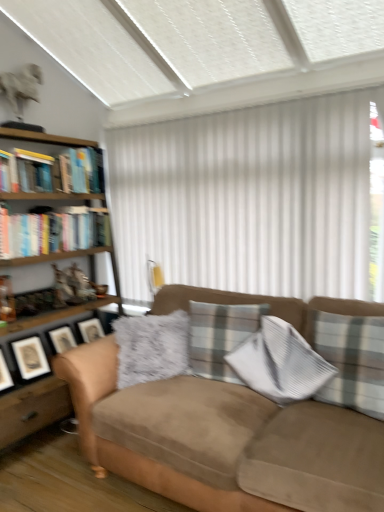
This screenshot has width=384, height=512. I want to click on hardcover books at left, which ranks as the fourth book in top-to-bottom order, so (53, 231).

Where is `suede couch at center`? The image size is (384, 512). suede couch at center is located at coordinates pyautogui.click(x=226, y=443).

Identify the location of hardcover book at left, the 3th book positioned from the bottom. (28, 170).

Measure the distance between point [13,193] and camera.

Point [13,193] and camera are 8.58 feet apart from each other.

This screenshot has width=384, height=512. What do you see at coordinates (351, 360) in the screenshot? I see `plaid fabric pillow at right, which is the second pillow from left to right` at bounding box center [351, 360].

Where is `hardcover book at left, arranged as the third book when viewed from the top`? hardcover book at left, arranged as the third book when viewed from the top is located at coordinates (8, 172).

Based on the photo, would you say plaid fabric pillow at center, which appears as the 1th pillow when viewed from the left, is inside or outside plaid fabric pillow at right, which is the second pillow from left to right?

plaid fabric pillow at center, which appears as the 1th pillow when viewed from the left, is spatially situated outside plaid fabric pillow at right, which is the second pillow from left to right.

Does plaid fabric pillow at center, marked as the 2th pillow in a right-to-left arrangement, have a smaller size compared to plaid fabric pillow at right, which is the second pillow from left to right?

Indeed, plaid fabric pillow at center, marked as the 2th pillow in a right-to-left arrangement, has a smaller size compared to plaid fabric pillow at right, which is the second pillow from left to right.

Which object is wider, plaid fabric pillow at center, which appears as the 1th pillow when viewed from the left, or plaid fabric pillow at right, which is the second pillow from left to right?

plaid fabric pillow at right, which is the second pillow from left to right, is wider.

In the image, there is a hardcover book at upper left, the fourth book in the bottom-to-top sequence. At what (x,y) coordinates should I click in order to perform the action: click on curtain below it (from the image's perspective). Please return your answer as a coordinate pair (x, y). This screenshot has height=512, width=384. Looking at the image, I should click on (247, 199).

Considering the relative sizes of hardcover book at upper left, which is the first book in top-to-bottom order, and white vertical blinds at center in the image provided, is hardcover book at upper left, which is the first book in top-to-bottom order, bigger than white vertical blinds at center?

Incorrect, hardcover book at upper left, which is the first book in top-to-bottom order, is not larger than white vertical blinds at center.

Who is shorter, hardcover book at upper left, the fourth book in the bottom-to-top sequence, or white vertical blinds at center?

With less height is hardcover book at upper left, the fourth book in the bottom-to-top sequence.

Is point (93, 152) positioned behind point (366, 260)?

Yes, it is behind point (366, 260).

Considering the positions of objects hardcover book at left, the 3th book positioned from the bottom, and suede couch at center in the image provided, who is more to the right, hardcover book at left, the 3th book positioned from the bottom, or suede couch at center?

Positioned to the right is suede couch at center.

Is hardcover book at left, the 3th book positioned from the bottom, directly adjacent to suede couch at center?

There is a gap between hardcover book at left, the 3th book positioned from the bottom, and suede couch at center.

In terms of size, does hardcover book at left, the 3th book positioned from the bottom, appear bigger or smaller than suede couch at center?

Considering their sizes, hardcover book at left, the 3th book positioned from the bottom, takes up less space than suede couch at center.

Looking at this image, from a real-world perspective, who is located higher, hardcover book at left, which appears as the 2th book when viewed from the top, or suede couch at center?

From a 3D spatial view, hardcover book at left, which appears as the 2th book when viewed from the top, is above.

Measure the distance from plaid fabric pillow at right, which is the second pillow from left to right, to matte black picture frame at left.

They are 5.94 feet apart.

Is plaid fabric pillow at right, which is the second pillow from left to right, closer to camera compared to matte black picture frame at left?

Yes, the depth of plaid fabric pillow at right, which is the second pillow from left to right, is less than that of matte black picture frame at left.

Can you tell me how much plaid fabric pillow at right, which appears as the first pillow when viewed from the right, and matte black picture frame at left differ in facing direction?

There is a 101-degree angle between the facing directions of plaid fabric pillow at right, which appears as the first pillow when viewed from the right, and matte black picture frame at left.

Looking at this image, is plaid fabric pillow at right, which is the second pillow from left to right, thinner than matte black picture frame at left?

Incorrect, the width of plaid fabric pillow at right, which is the second pillow from left to right, is not less than that of matte black picture frame at left.

From the image's perspective, between matte black picture frame at left and plaid fabric pillow at center, marked as the 2th pillow in a right-to-left arrangement, which one is located above?

From the image's view, plaid fabric pillow at center, marked as the 2th pillow in a right-to-left arrangement, is above.

Considering the relative sizes of matte black picture frame at left and plaid fabric pillow at center, which appears as the 1th pillow when viewed from the left, in the image provided, is matte black picture frame at left wider than plaid fabric pillow at center, which appears as the 1th pillow when viewed from the left,?

No.

Is matte black picture frame at left positioned before plaid fabric pillow at center, marked as the 2th pillow in a right-to-left arrangement?

No, matte black picture frame at left is further to the viewer.

Locate an element on the screen. The image size is (384, 512). the 1st pillow counting from the right side of the matte black picture frame at left is located at coordinates (220, 336).

From the image's perspective, is matte black picture frame at left located above or below plaid fabric pillow at right, which is the second pillow from left to right?

Clearly, from the image's perspective, matte black picture frame at left is below plaid fabric pillow at right, which is the second pillow from left to right.

Is plaid fabric pillow at right, which appears as the first pillow when viewed from the right, at the back of matte black picture frame at left?

No, matte black picture frame at left is not facing the opposite direction of plaid fabric pillow at right, which appears as the first pillow when viewed from the right.

Looking at this image, would you say matte black picture frame at left is a long distance from plaid fabric pillow at right, which appears as the first pillow when viewed from the right?

matte black picture frame at left is positioned a significant distance from plaid fabric pillow at right, which appears as the first pillow when viewed from the right.

Which is in front, point (36, 355) or point (354, 384)?

The point (354, 384) is more forward.

Looking at this image, does plaid fabric pillow at center, which appears as the 1th pillow when viewed from the left, contain woodenmaterial/texturebookcase at left?

No, woodenmaterial/texturebookcase at left is located outside of plaid fabric pillow at center, which appears as the 1th pillow when viewed from the left.

Would you say plaid fabric pillow at center, marked as the 2th pillow in a right-to-left arrangement, is to the left or to the right of woodenmaterial/texturebookcase at left in the picture?

plaid fabric pillow at center, marked as the 2th pillow in a right-to-left arrangement, is to the right of woodenmaterial/texturebookcase at left.

Is plaid fabric pillow at center, which appears as the 1th pillow when viewed from the left, wider or thinner than woodenmaterial/texturebookcase at left?

plaid fabric pillow at center, which appears as the 1th pillow when viewed from the left, is thinner than woodenmaterial/texturebookcase at left.

Who is bigger, plaid fabric pillow at center, which appears as the 1th pillow when viewed from the left, or woodenmaterial/texturebookcase at left?

woodenmaterial/texturebookcase at left is bigger.

I want to click on pillow located underneath the plaid fabric pillow at right, which is the second pillow from left to right (from a real-world perspective), so [220, 336].

I want to click on book that is the 4th one when counting backward from the white vertical blinds at center, so click(x=82, y=170).

Considering their positions, is hardcover book at upper left, which is the first book in top-to-bottom order, positioned further to woodenmaterial/texturebookcase at left than hardcover book at left, which appears as the 2th book when viewed from the top?

The object further to woodenmaterial/texturebookcase at left is hardcover book at left, which appears as the 2th book when viewed from the top.

From the image, which object appears to be farther from plaid fabric pillow at right, which is the second pillow from left to right, hardcover book at left, marked as the 2th book in a bottom-to-top arrangement, or hardcover book at left, which appears as the 2th book when viewed from the top?

hardcover book at left, marked as the 2th book in a bottom-to-top arrangement.

From the image, which object appears to be farther from suede couch at center, white vertical blinds at center or hardcover books at left, which ranks as the fourth book in top-to-bottom order?

hardcover books at left, which ranks as the fourth book in top-to-bottom order.

Looking at the image, which one is located further to woodenmaterial/texturebookcase at left, hardcover book at left, which appears as the 2th book when viewed from the top, or matte black picture frame at left?

matte black picture frame at left is further to woodenmaterial/texturebookcase at left.

From the image, which object appears to be farther from hardcover book at left, which appears as the 2th book when viewed from the top, white vertical blinds at center or plaid fabric pillow at right, which appears as the first pillow when viewed from the right?

The object further to hardcover book at left, which appears as the 2th book when viewed from the top, is plaid fabric pillow at right, which appears as the first pillow when viewed from the right.

Based on their spatial positions, is hardcover book at left, the 3th book positioned from the bottom, or woodenmaterial/texturebookcase at left further from hardcover books at left, which ranks as the fourth book in top-to-bottom order?

Among the two, hardcover book at left, the 3th book positioned from the bottom, is located further to hardcover books at left, which ranks as the fourth book in top-to-bottom order.

From the image, which object appears to be farther from suede couch at center, plaid fabric pillow at right, which is the second pillow from left to right, or hardcover book at left, arranged as the third book when viewed from the top?

hardcover book at left, arranged as the third book when viewed from the top.

Looking at the image, which one is located closer to hardcover book at upper left, which is the first book in top-to-bottom order, white vertical blinds at center or hardcover books at left, which ranks as the fourth book in top-to-bottom order?

hardcover books at left, which ranks as the fourth book in top-to-bottom order, is positioned closer to the anchor hardcover book at upper left, which is the first book in top-to-bottom order.

Where is `curtain situated between hardcover book at upper left, the fourth book in the bottom-to-top sequence, and plaid fabric pillow at right, which is the second pillow from left to right, from left to right`? curtain situated between hardcover book at upper left, the fourth book in the bottom-to-top sequence, and plaid fabric pillow at right, which is the second pillow from left to right, from left to right is located at coordinates (247, 199).

This screenshot has height=512, width=384. I want to click on picture frame between hardcover book at left, arranged as the third book when viewed from the top, and white vertical blinds at center, so click(30, 358).

I want to click on pillow positioned between suede couch at center and plaid fabric pillow at center, marked as the 2th pillow in a right-to-left arrangement, from near to far, so click(x=351, y=360).

You are a GUI agent. You are given a task and a screenshot of the screen. Output one action in this format:
    pyautogui.click(x=<x>, y=<y>)
    Task: Click on the studio couch between hardcover book at left, the 3th book positioned from the bottom, and plaid fabric pillow at right, which appears as the first pillow when viewed from the right, in the horizontal direction
    Image resolution: width=384 pixels, height=512 pixels.
    Given the screenshot: What is the action you would take?
    pyautogui.click(x=226, y=443)